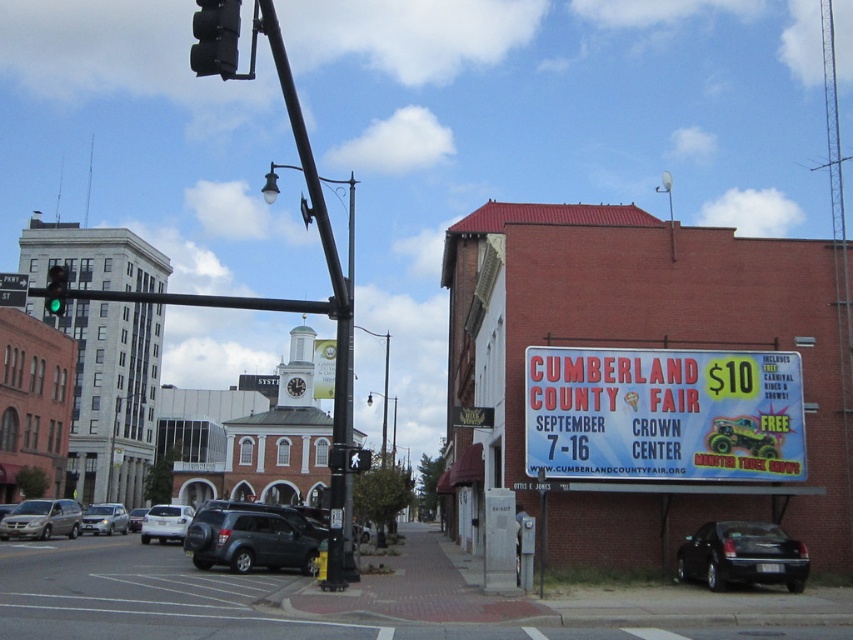
You are a delivery driver approaching an intersection. You see a black metal pole at upper center and a silver metallic minivan at lower left. Which object is taller?

The black metal pole at upper center is taller than the silver metallic minivan at lower left according to the description.